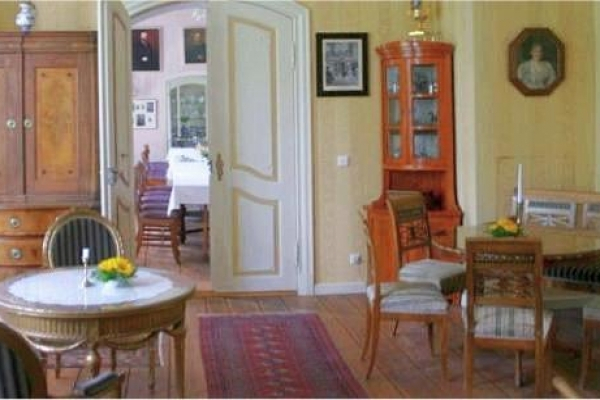
What are the coordinates of `table` in the screenshot? It's located at (560, 242), (157, 292).